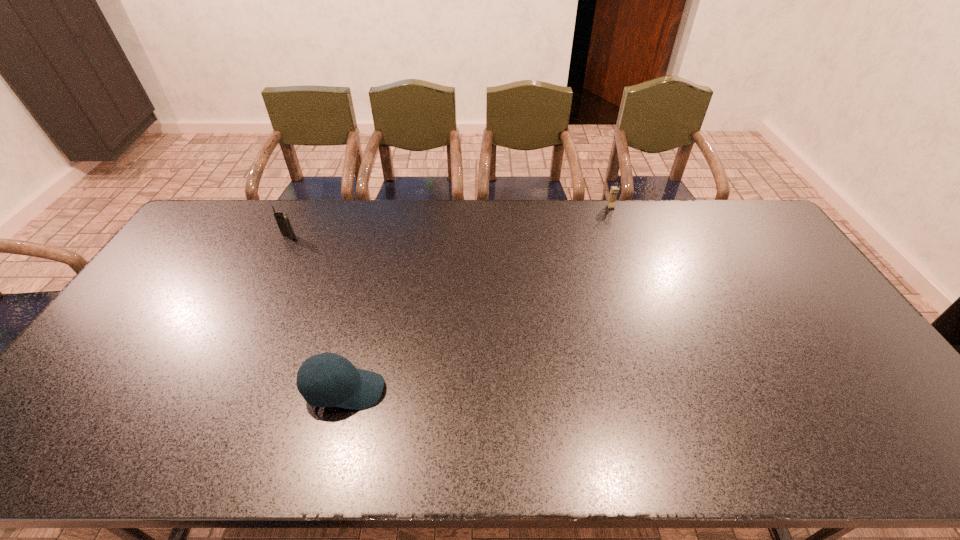
Where is `free space that satisfies the following two spatial constraints: 1. on the front of the right cellular telephone, where the keypad is located; 2. on the front-facing side of the second object from left to right`? The image size is (960, 540). free space that satisfies the following two spatial constraints: 1. on the front of the right cellular telephone, where the keypad is located; 2. on the front-facing side of the second object from left to right is located at coordinates (x=678, y=390).

Where is `free spot that satisfies the following two spatial constraints: 1. on the front of the farthest object, where the keypad is located; 2. on the front-facing side of the nearest object`? This screenshot has width=960, height=540. free spot that satisfies the following two spatial constraints: 1. on the front of the farthest object, where the keypad is located; 2. on the front-facing side of the nearest object is located at coordinates (678, 390).